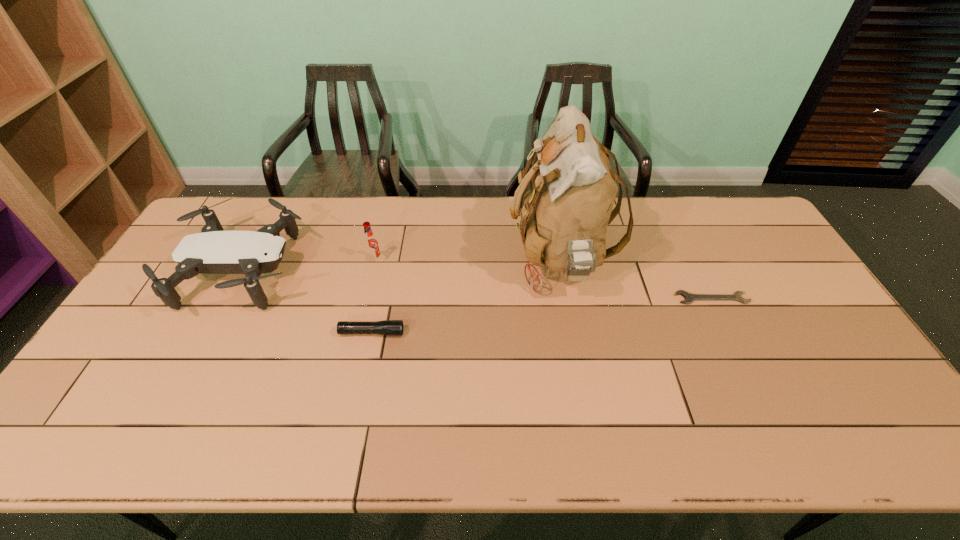
The image size is (960, 540). In order to click on vacant space at the near edge of the desktop in this screenshot , I will do [x=163, y=450].

This screenshot has height=540, width=960. I want to click on blank space at the left edge of the desktop, so click(152, 354).

Image resolution: width=960 pixels, height=540 pixels. I want to click on vacant space at the right edge of the desktop, so click(x=736, y=257).

This screenshot has width=960, height=540. Find the location of `free space at the near left corner`. free space at the near left corner is located at coordinates (68, 429).

Image resolution: width=960 pixels, height=540 pixels. I want to click on empty location between the second shortest object and the drone, so click(308, 302).

In order to click on free point between the drone and the nearest object in this screenshot , I will do `click(308, 302)`.

The image size is (960, 540). Find the location of `free area in between the root beer and the backpack`. free area in between the root beer and the backpack is located at coordinates (468, 261).

This screenshot has height=540, width=960. Identify the location of free space between the shortest object and the root beer. (543, 280).

Identify the location of vacant point located between the flashlight and the fourth object from left to right. (466, 297).

Image resolution: width=960 pixels, height=540 pixels. What are the coordinates of `vacant space that's between the root beer and the wrench` in the screenshot? It's located at (543, 280).